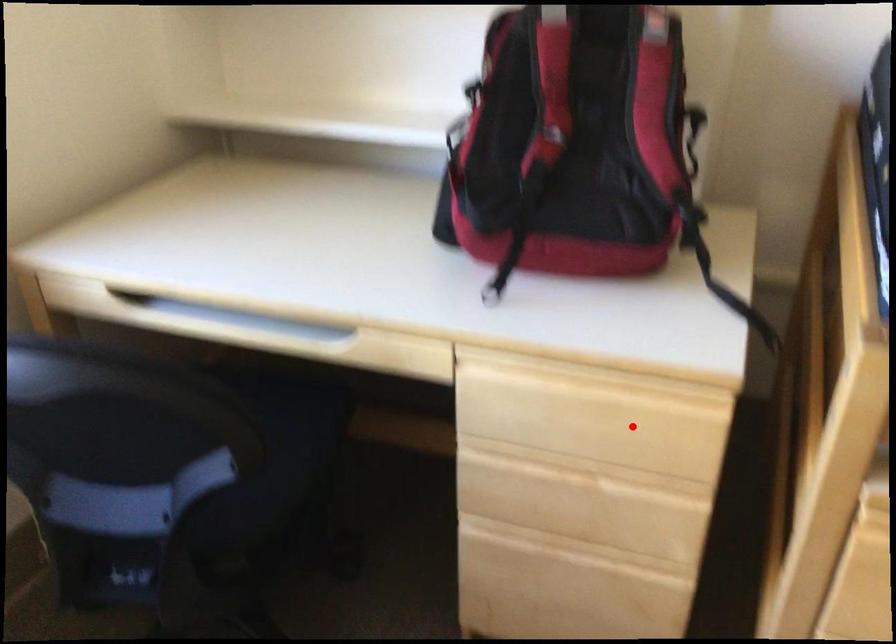
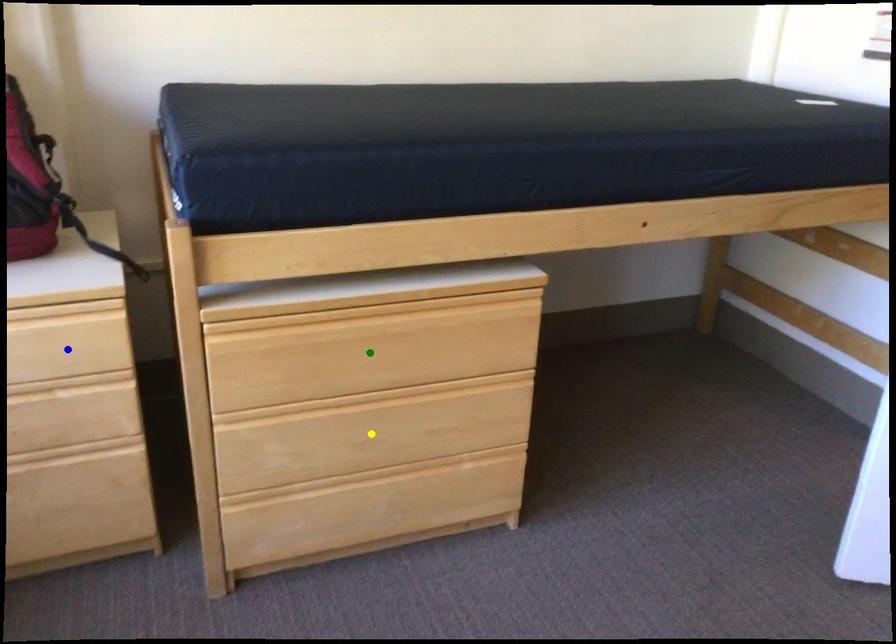
Question: I am providing you with two images of the same scene from different viewpoints. A red point is marked on the first image. You are given multiple points on the second image. Can you choose the point in image 2 that corresponds to the point in image 1?

Choices:
 (A) blue point
 (B) yellow point
 (C) green point

Answer: (A)